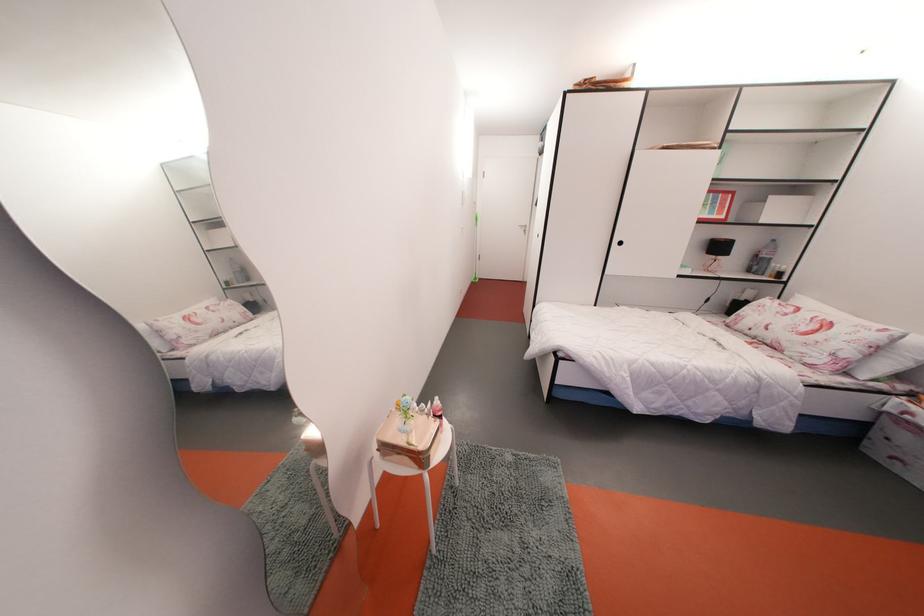
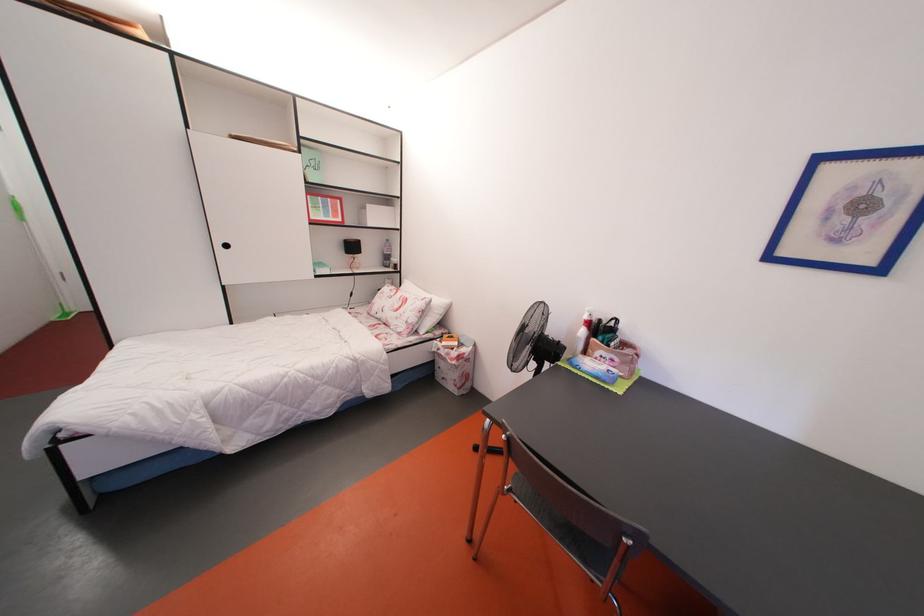
Where in the second image is the point corresponding to point 725,254 from the first image?

(359, 253)